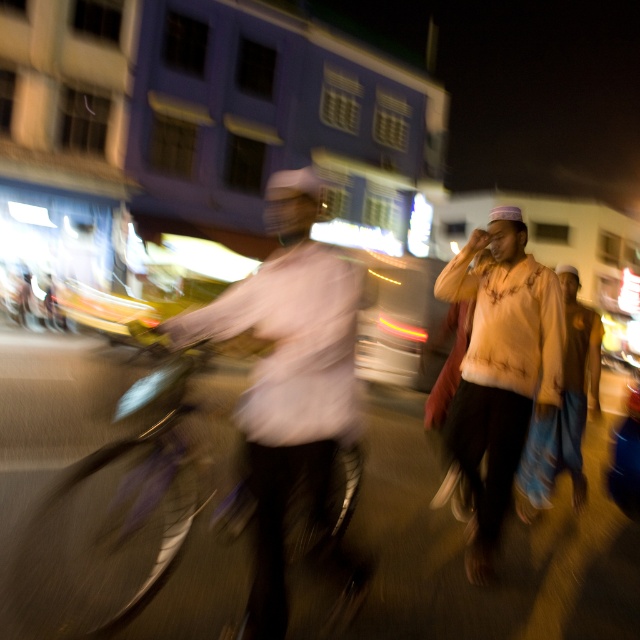
You are a photographer standing at the edge of the street. You want to capture the white matte shirt at center in your shot. Given that your camera has a 50mm lens with a field of view of 46 degrees, can you estimate if the point indicated by point (291, 392) will be within the frame if you aim directly at the building with blue and white walls?

The point (291, 392) indicates the white matte shirt at center. Since the photographer is aiming directly at the building with blue and white walls, the white matte shirt at center located at the center of the image would be within the camera frame as it is centered and within the 46 degree field of view.

You are a delivery person needing to quickly reach the building with blue and white walls. You see the metallic silver bicycle at left and the light orange cotton shirt at center. Which object is closer to you?

The metallic silver bicycle at left is closer to you because it is in front of the light orange cotton shirt at center.

You are a photographer trying to capture a candid shot of two people in the center of the scene. The two people are wearing a white matte shirt at center and a light brown fabric shirt at center. Since you want to focus on their faces, which shirt should you avoid zooming in on to prevent the other from blocking the view?

You should avoid zooming in on the light brown fabric shirt at center because the white matte shirt at center is narrower, so focusing on the wider light brown fabric shirt at center might block the view of the other person.